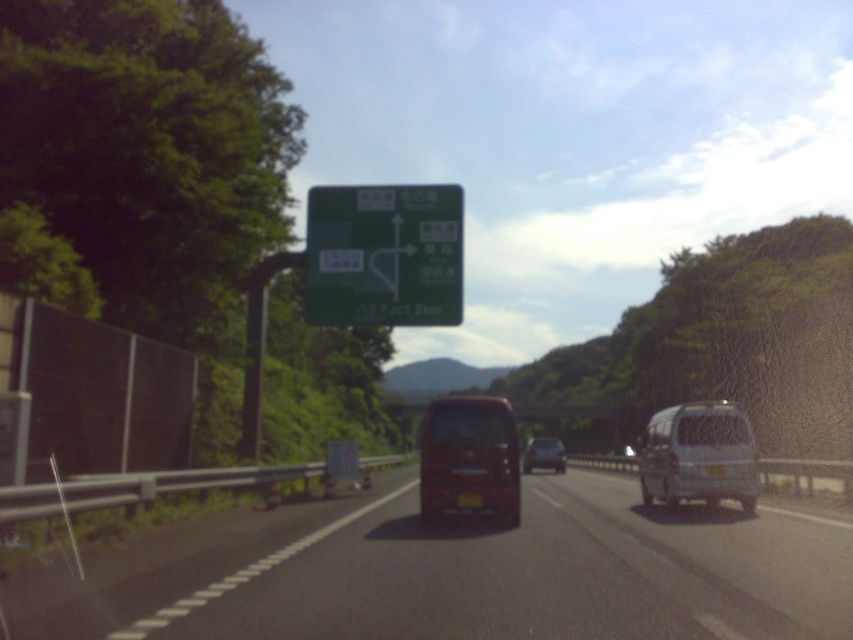
Question: Is the position of green matte sign at center less distant than that of black plastic license plate at center?

Choices:
 (A) yes
 (B) no

Answer: (B)

Question: Where is matte black van at center located in relation to white plastic license plate at center in the image?

Choices:
 (A) right
 (B) left

Answer: (A)

Question: Which object is the farthest from the silver metallic van at right?

Choices:
 (A) black plastic license plate at center
 (B) white plastic license plate at center
 (C) green matte sign at center
 (D) matte black van at center

Answer: (D)

Question: Can you confirm if metallic red bus at center is positioned to the left of white plastic license plate at center?

Choices:
 (A) yes
 (B) no

Answer: (A)

Question: Which object appears closest to the camera in this image?

Choices:
 (A) green matte sign at center
 (B) black plastic license plate at center
 (C) white plastic license plate at center
 (D) black rubber highway at center

Answer: (D)

Question: Among these points, which one is nearest to the camera?

Choices:
 (A) (543, 458)
 (B) (712, 474)
 (C) (714, 445)
 (D) (677, 513)

Answer: (B)